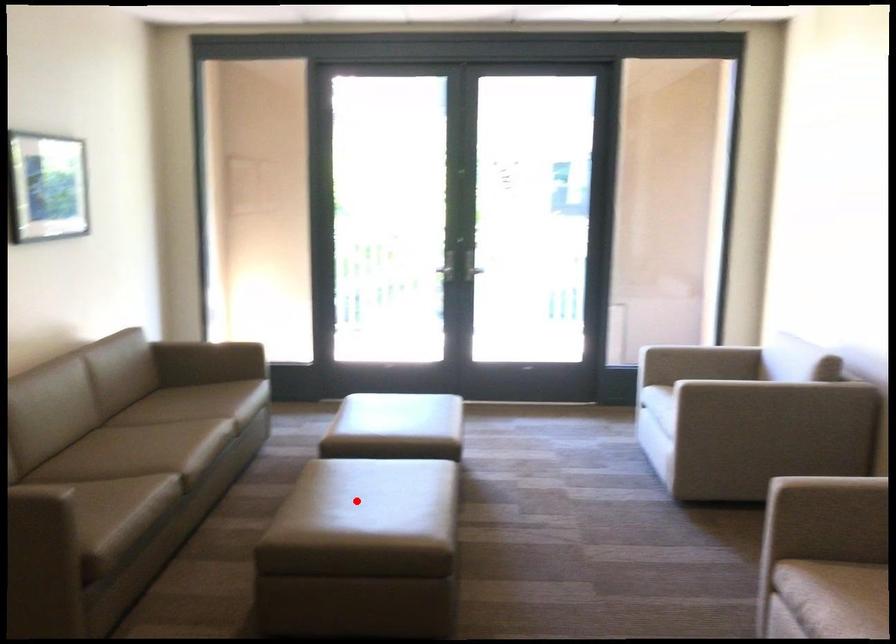
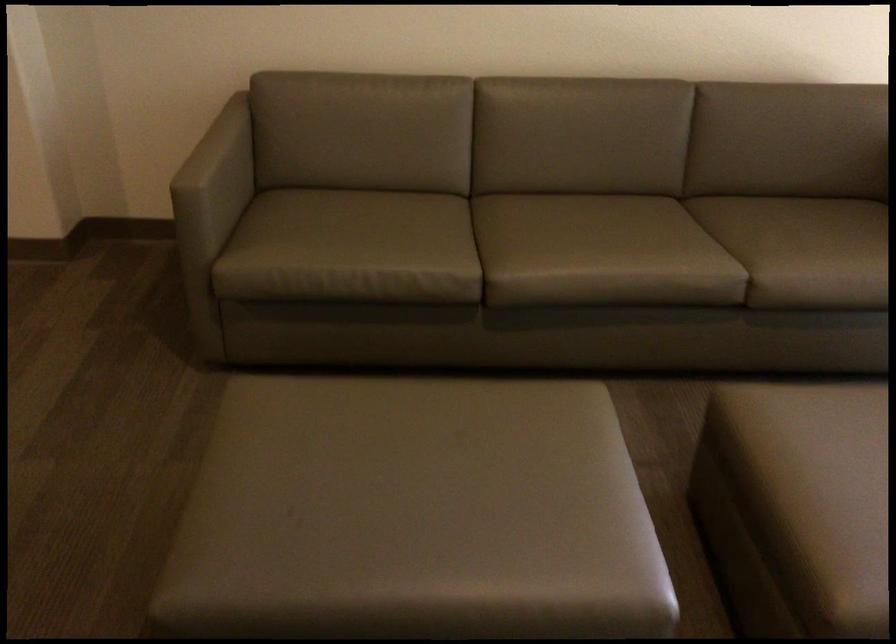
Question: I am providing you with two images of the same scene from different viewpoints. Image1 has a red point marked. In image2, the corresponding 3D location appears at what relative position? Reply with the corresponding letter.

Choices:
 (A) Closer
 (B) Farther

Answer: (A)